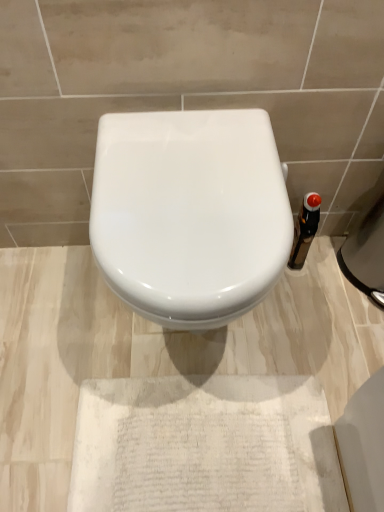
What do you see at coordinates (189, 213) in the screenshot? I see `white glossy toilet at center` at bounding box center [189, 213].

Identify the location of white glossy toilet at center. (189, 213).

The image size is (384, 512). What do you see at coordinates (305, 229) in the screenshot? I see `black glass bottle at right` at bounding box center [305, 229].

Image resolution: width=384 pixels, height=512 pixels. I want to click on black glass bottle at right, so click(305, 229).

Where is `white glossy toilet at center`? white glossy toilet at center is located at coordinates (189, 213).

Does black glass bottle at right appear on the left side of white glossy toilet at center?

Incorrect, black glass bottle at right is not on the left side of white glossy toilet at center.

Who is more distant, black glass bottle at right or white glossy toilet at center?

Positioned behind is black glass bottle at right.

Considering the positions of points (306, 213) and (158, 283), is point (306, 213) closer to camera compared to point (158, 283)?

No, (306, 213) is behind (158, 283).

From the image's perspective, which one is positioned higher, black glass bottle at right or white glossy toilet at center?

black glass bottle at right appears higher in the image.

From a real-world perspective, is black glass bottle at right beneath white glossy toilet at center?

Yes, from a real-world perspective, black glass bottle at right is beneath white glossy toilet at center.

Considering the sizes of objects black glass bottle at right and white glossy toilet at center in the image provided, who is wider, black glass bottle at right or white glossy toilet at center?

With larger width is white glossy toilet at center.

Between black glass bottle at right and white glossy toilet at center, which one has more height?

Standing taller between the two is white glossy toilet at center.

Considering the relative sizes of black glass bottle at right and white glossy toilet at center in the image provided, is black glass bottle at right bigger than white glossy toilet at center?

Incorrect, black glass bottle at right is not larger than white glossy toilet at center.

Could white glossy toilet at center be considered to be inside black glass bottle at right?

No, white glossy toilet at center is not a part of black glass bottle at right.

Are black glass bottle at right and white glossy toilet at center far apart?

No, black glass bottle at right is not far from white glossy toilet at center.

Is black glass bottle at right positioned with its back to white glossy toilet at center?

No.

How many degrees apart are the facing directions of black glass bottle at right and white glossy toilet at center?

8.51 degrees separate the facing orientations of black glass bottle at right and white glossy toilet at center.

How far apart are black glass bottle at right and white glossy toilet at center?

A distance of 20.05 inches exists between black glass bottle at right and white glossy toilet at center.

The width and height of the screenshot is (384, 512). What are the coordinates of `bottle on the right side of white glossy toilet at center` in the screenshot? It's located at (305, 229).

Between white glossy toilet at center and black glass bottle at right, which one appears on the left side from the viewer's perspective?

From the viewer's perspective, white glossy toilet at center appears more on the left side.

From the picture: Which object is further away from the camera taking this photo, white glossy toilet at center or black glass bottle at right?

black glass bottle at right is more distant.

Considering the positions of points (91, 230) and (302, 243), is point (91, 230) closer to camera compared to point (302, 243)?

That is True.

From the image's perspective, is white glossy toilet at center above black glass bottle at right?

No.

From a real-world perspective, is white glossy toilet at center positioned above or below black glass bottle at right?

In terms of real-world spatial position, white glossy toilet at center is above black glass bottle at right.

Is white glossy toilet at center thinner than black glass bottle at right?

No, white glossy toilet at center is not thinner than black glass bottle at right.

From their relative heights in the image, would you say white glossy toilet at center is taller or shorter than black glass bottle at right?

Clearly, white glossy toilet at center is taller compared to black glass bottle at right.

Can you confirm if white glossy toilet at center is bigger than black glass bottle at right?

Yes.

Is white glossy toilet at center not inside black glass bottle at right?

Indeed, white glossy toilet at center is completely outside black glass bottle at right.

Are white glossy toilet at center and black glass bottle at right making contact?

No, white glossy toilet at center is not beside black glass bottle at right.

Is black glass bottle at right at the back of white glossy toilet at center?

white glossy toilet at center does not have its back to black glass bottle at right.

Identify the location of bottle below the white glossy toilet at center (from a real-world perspective). The height and width of the screenshot is (512, 384). (305, 229).

Identify the location of toilet located above the black glass bottle at right (from a real-world perspective). The height and width of the screenshot is (512, 384). (189, 213).

Identify the location of toilet in front of the black glass bottle at right. Image resolution: width=384 pixels, height=512 pixels. (189, 213).